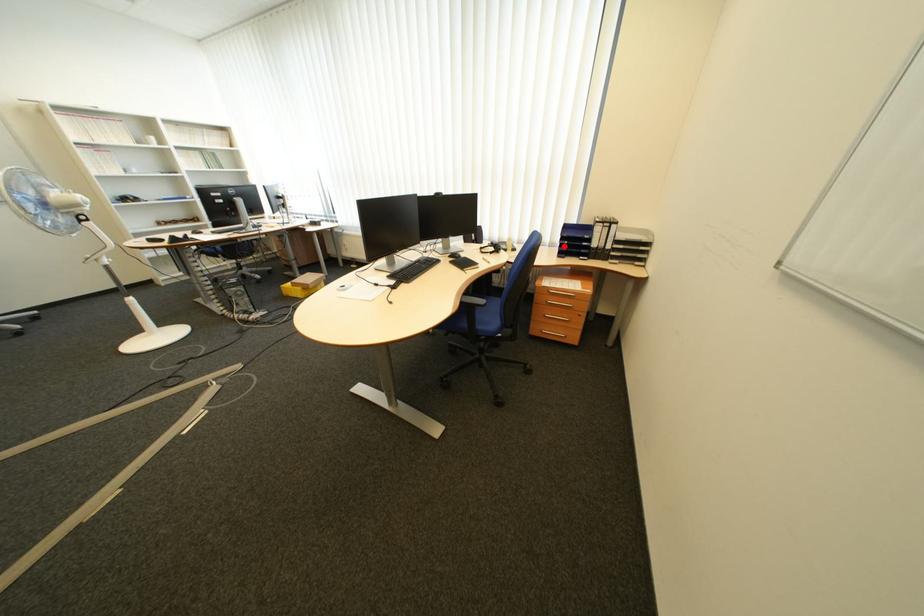
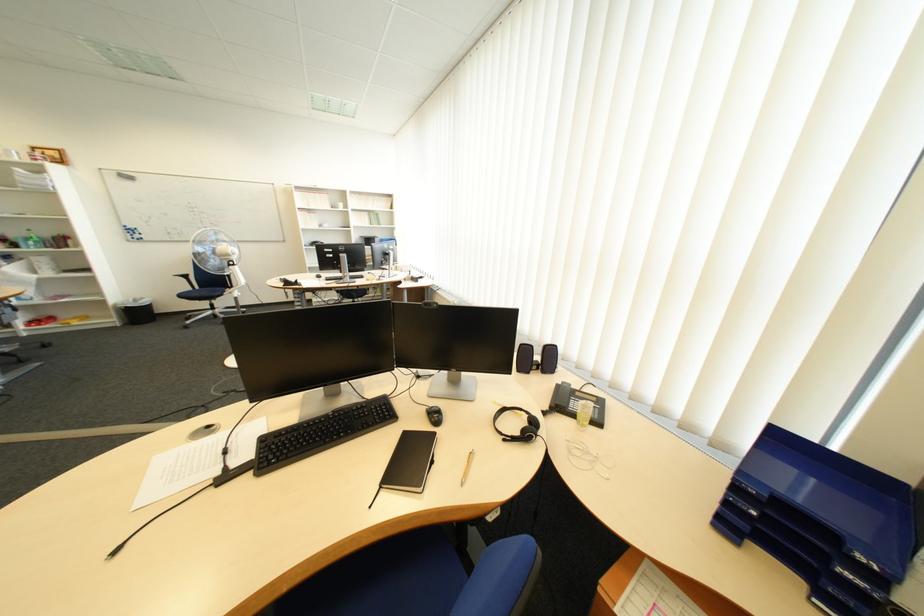
Where in the second image is the point corresponding to the highlighted location from the first image?

(730, 446)